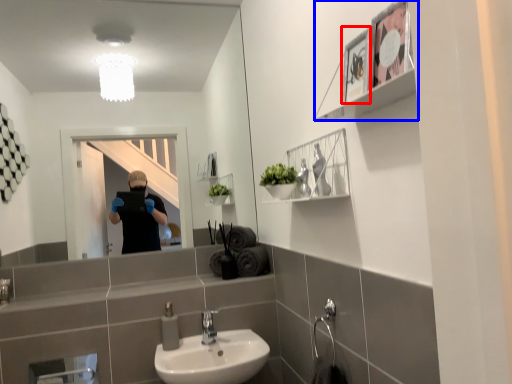
Question: Which object appears closest to the camera in this image, picture frame (highlighted by a red box) or cabinet (highlighted by a blue box)?

Choices:
 (A) picture frame
 (B) cabinet

Answer: (B)